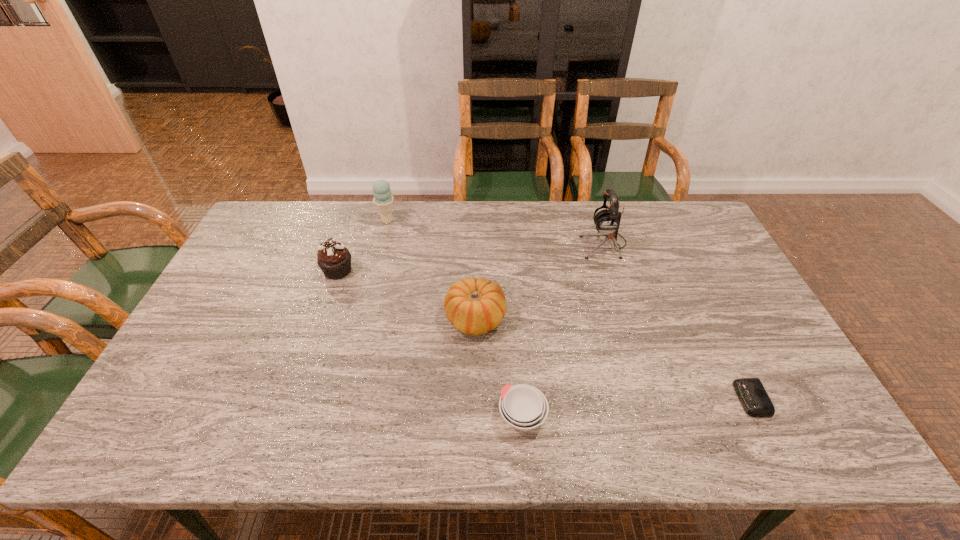
Identify the location of vacant area situated 0.280m on the front of the tallest object. (630, 327).

Image resolution: width=960 pixels, height=540 pixels. Find the location of `free spot located on the right of the ice cream`. free spot located on the right of the ice cream is located at coordinates (440, 221).

The width and height of the screenshot is (960, 540). I want to click on vacant region located on the back of the gourd, so click(476, 267).

Where is `vacant space situated on the front of the cupcake`? The image size is (960, 540). vacant space situated on the front of the cupcake is located at coordinates (314, 342).

The height and width of the screenshot is (540, 960). I want to click on vacant space situated on the left of the soup bowl, so click(446, 416).

Identify the location of vacant space located 0.260m on the display of the shortest object. This screenshot has width=960, height=540. (630, 399).

The image size is (960, 540). What are the coordinates of `free space located 0.200m on the display of the shortest object` in the screenshot? It's located at (655, 399).

Identify the location of free space located 0.330m on the display of the shortest object. (600, 399).

Find the location of a particular element. This screenshot has height=540, width=960. earphone that is at the far edge is located at coordinates (607, 221).

Identify the location of ice cream located in the far edge section of the desktop. The height and width of the screenshot is (540, 960). (383, 200).